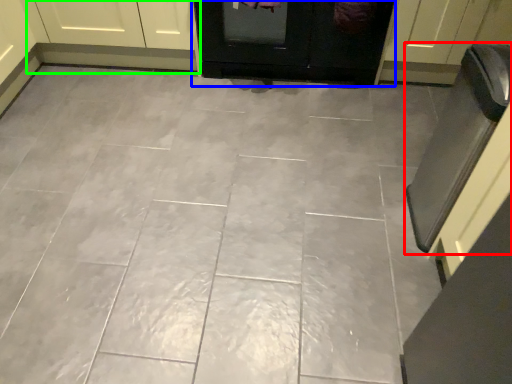
Question: Estimate the real-world distances between objects in this image. Which object is farther from oven (highlighted by a red box), door (highlighted by a blue box) or cabinetry (highlighted by a green box)?

Choices:
 (A) door
 (B) cabinetry

Answer: (B)